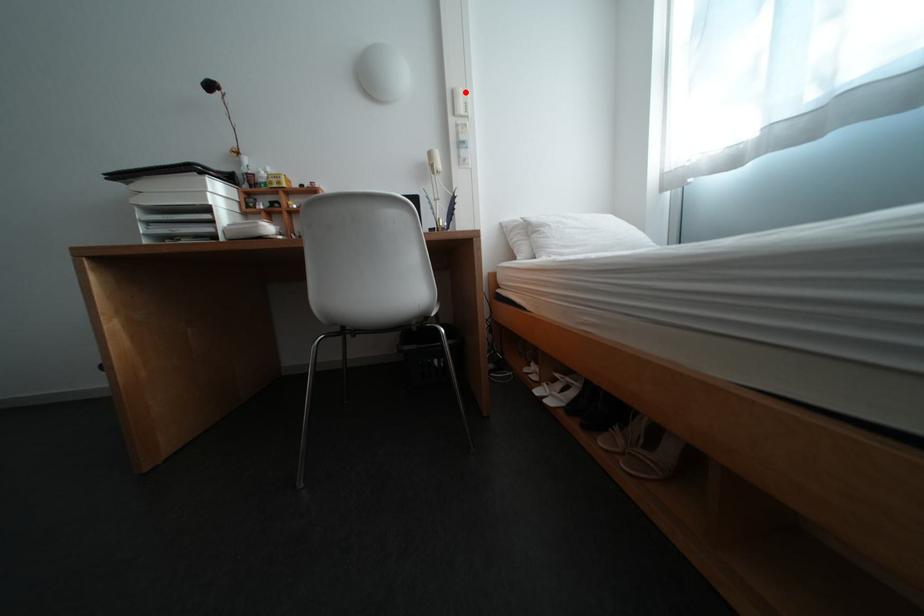
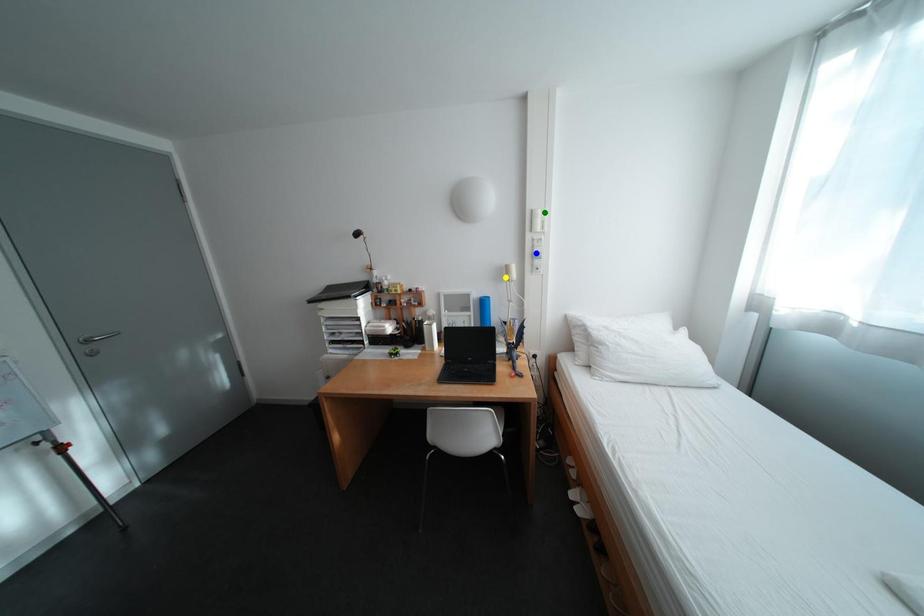
Question: I am providing you with two images of the same scene from different viewpoints. A red point is marked on the first image. You are given multiple points on the second image. Which spot in image 2 lines up with the point in image 1?

Choices:
 (A) green point
 (B) yellow point
 (C) blue point

Answer: (A)